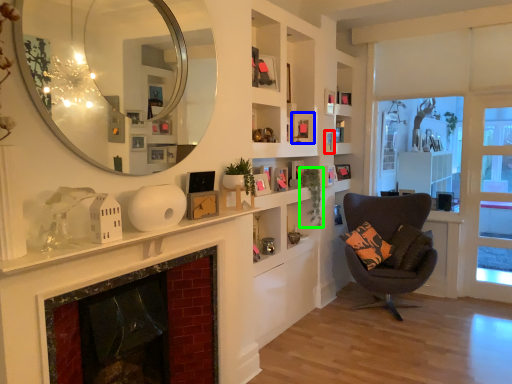
Question: Which object is the closest to the picture frame (highlighted by a red box)? Choose among these: picture frame (highlighted by a blue box) or plant (highlighted by a green box).

Choices:
 (A) picture frame
 (B) plant

Answer: (A)